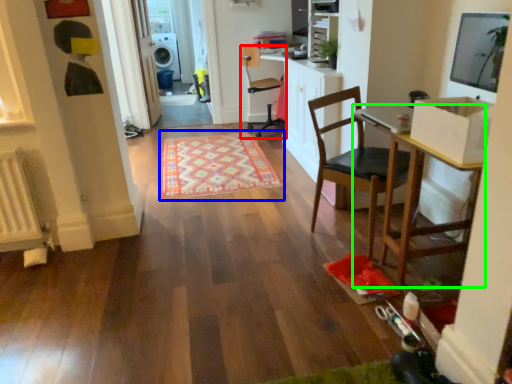
Question: Which is farther away from chair (highlighted by a red box)? mat (highlighted by a blue box) or table (highlighted by a green box)?

Choices:
 (A) mat
 (B) table

Answer: (B)